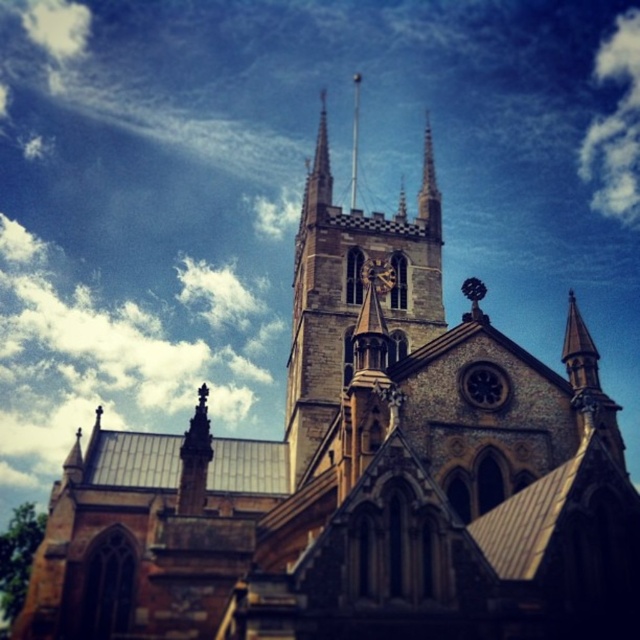
Question: In this image, where is dark gray stone clock at upper center located relative to stone spire at upper center?

Choices:
 (A) below
 (B) above

Answer: (A)

Question: Which of these objects is positioned farthest from the dark gray stone clock at upper center?

Choices:
 (A) brown stone clock tower at center
 (B) smooth stone spire at center
 (C) stone spire at upper center

Answer: (B)

Question: Which object is the farthest from the brown stone clock tower at center?

Choices:
 (A) smooth stone spire at center
 (B) dark gray stone clock at upper center

Answer: (B)

Question: Is dark gray stone clock at upper center in front of stone spire at upper center?

Choices:
 (A) no
 (B) yes

Answer: (B)

Question: Can you confirm if brown stone clock tower at center is bigger than smooth stone spire at center?

Choices:
 (A) no
 (B) yes

Answer: (B)

Question: Which of the following is the closest to the observer?

Choices:
 (A) (294, 348)
 (B) (486, 385)
 (C) (429, 140)

Answer: (B)